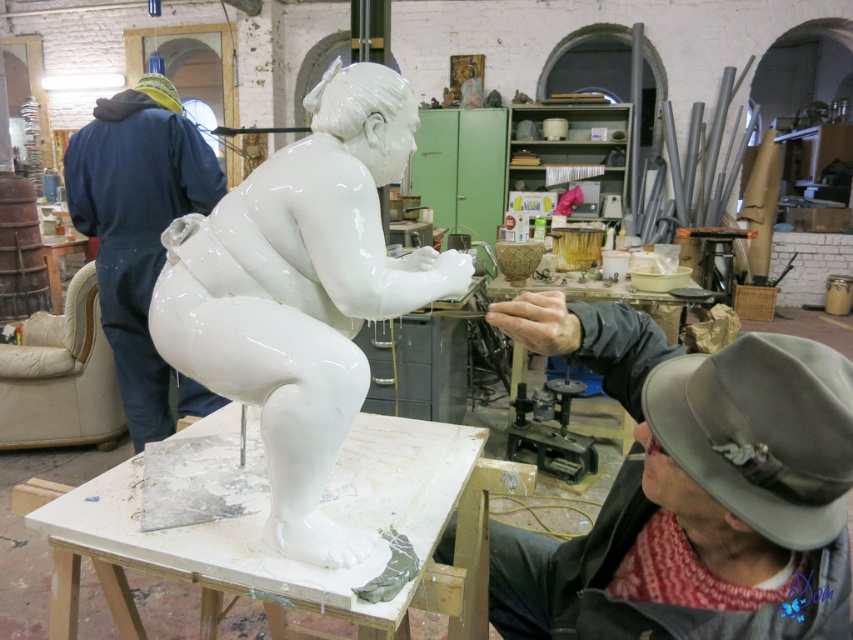
Consider the image. Who is higher up, white glossy statue at center or gray felt fedora at lower right?

white glossy statue at center

Is white glossy statue at center closer to the viewer compared to gray felt fedora at lower right?

No.

Where is `white glossy statue at center`? The width and height of the screenshot is (853, 640). white glossy statue at center is located at coordinates (302, 292).

Is point (398, 280) farther from viewer compared to point (144, 154)?

No, it is in front of (144, 154).

Is white glossy statue at center further to camera compared to blue denim jumpsuit at left?

That is False.

Find the location of a particular element. The image size is (853, 640). white glossy statue at center is located at coordinates (302, 292).

From the picture: Does gray felt fedora at lower right appear under blue denim jumpsuit at left?

Indeed, gray felt fedora at lower right is positioned under blue denim jumpsuit at left.

Is point (811, 406) positioned after point (97, 177)?

No, it is in front of (97, 177).

The width and height of the screenshot is (853, 640). Find the location of `gray felt fedora at lower right`. gray felt fedora at lower right is located at coordinates (761, 432).